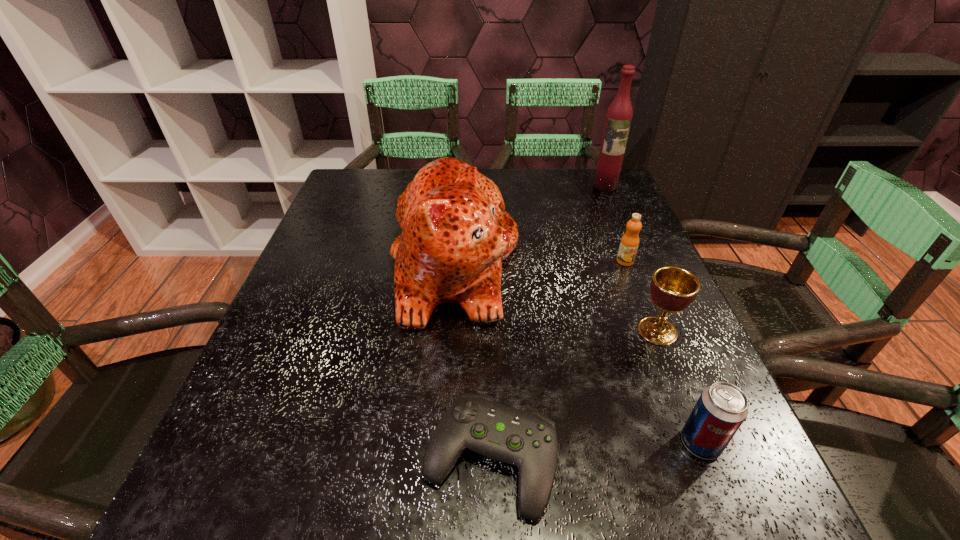
Identify the location of vacant space at the left edge of the desktop. (350, 214).

Locate an element on the screen. blank space at the right edge of the desktop is located at coordinates (654, 357).

You are a GUI agent. You are given a task and a screenshot of the screen. Output one action in this format:
    pyautogui.click(x=<x>, y=<y>)
    Task: Click on the vacant point at the far left corner
    
    Given the screenshot: What is the action you would take?
    pyautogui.click(x=384, y=177)

At what (x,y) coordinates should I click in order to perform the action: click on vacant area at the near left corner. Please return your answer as a coordinate pair (x, y). Looking at the image, I should click on (237, 485).

Find the location of a particular element. The width and height of the screenshot is (960, 540). empty space that is in between the beer can and the chalice is located at coordinates (679, 387).

This screenshot has height=540, width=960. In order to click on vacant area that lies between the orange juice and the tallest object in this screenshot , I will do `click(615, 224)`.

Locate an element on the screen. vacant area that lies between the fifth shortest object and the beer can is located at coordinates (578, 354).

In order to click on empty space between the beer can and the orange juice in this screenshot , I will do `click(662, 352)`.

The width and height of the screenshot is (960, 540). I want to click on vacant area that lies between the beer can and the liquor, so click(x=653, y=314).

Find the location of a particular element. vacant space that is in between the beer can and the chalice is located at coordinates (679, 387).